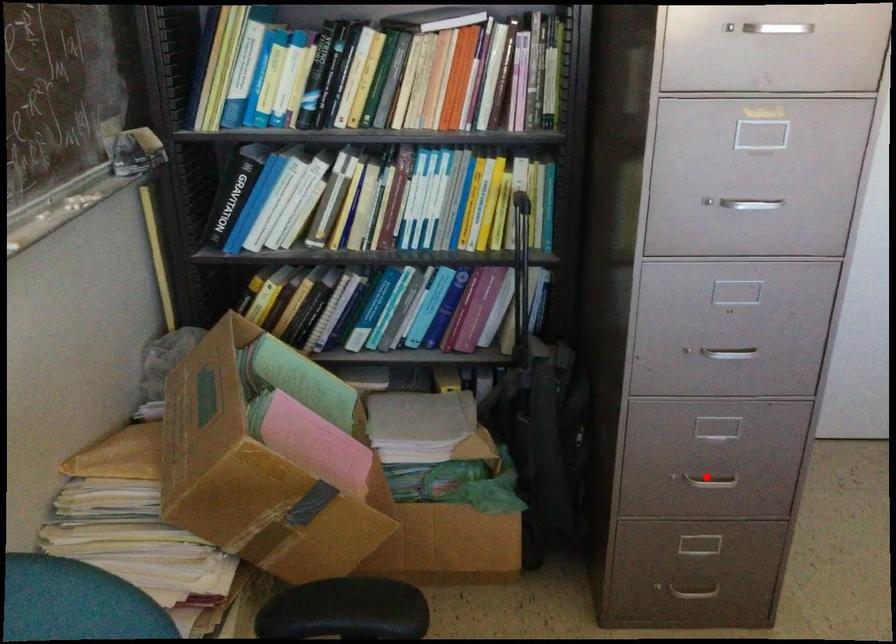
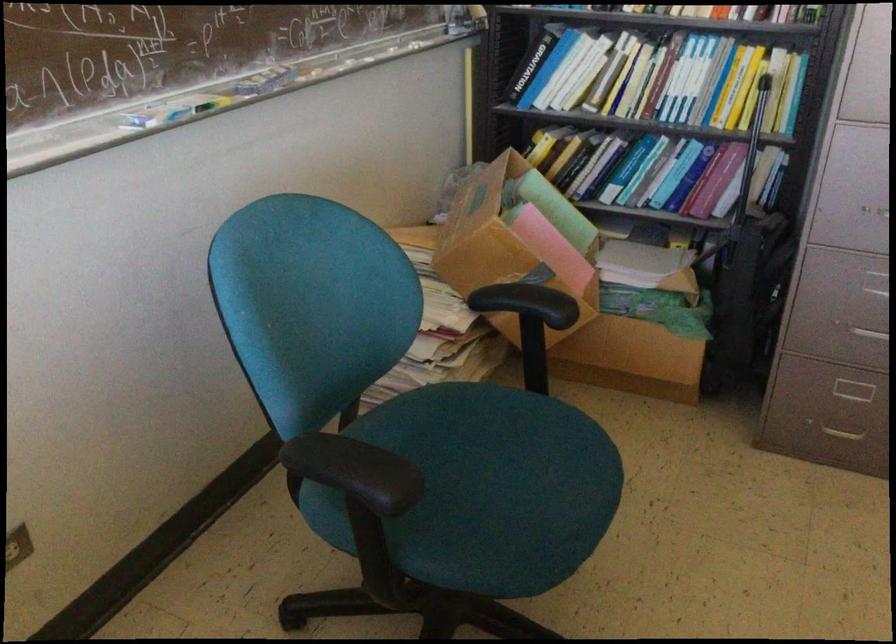
Question: I am providing you with two images of the same scene from different viewpoints. Given a red point in image1, look at the same physical point in image2. Is it:

Choices:
 (A) Closer to the viewpoint
 (B) Farther from the viewpoint

Answer: (B)